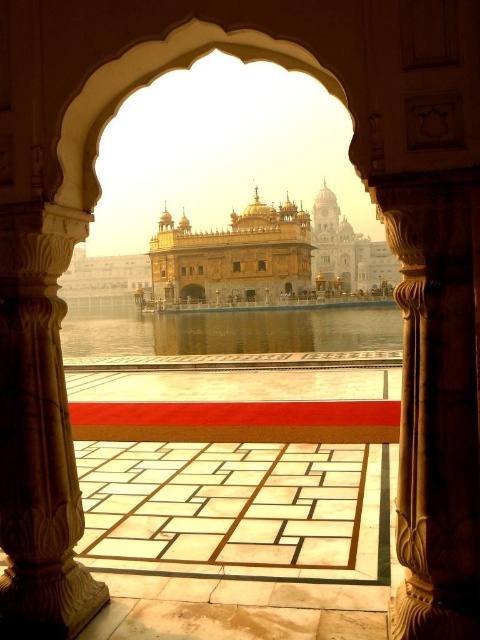
Question: Does white marble pillar at left appear over golden polished dome at center?

Choices:
 (A) yes
 (B) no

Answer: (B)

Question: Which point is farther to the camera?

Choices:
 (A) carved stone pillar at right
 (B) golden polished dome at center
 (C) white marble pillar at left

Answer: (B)

Question: Does carved stone pillar at right appear under clear water at center?

Choices:
 (A) yes
 (B) no

Answer: (A)

Question: Does carved stone pillar at right appear on the right side of golden polished dome at center?

Choices:
 (A) yes
 (B) no

Answer: (A)

Question: Which is farther from the clear water at center?

Choices:
 (A) carved stone pillar at right
 (B) golden polished dome at center
 (C) white marble pillar at left

Answer: (A)

Question: Estimate the real-world distances between objects in this image. Which object is farther from the white marble pillar at left?

Choices:
 (A) golden polished dome at center
 (B) clear water at center
 (C) carved stone pillar at right

Answer: (A)